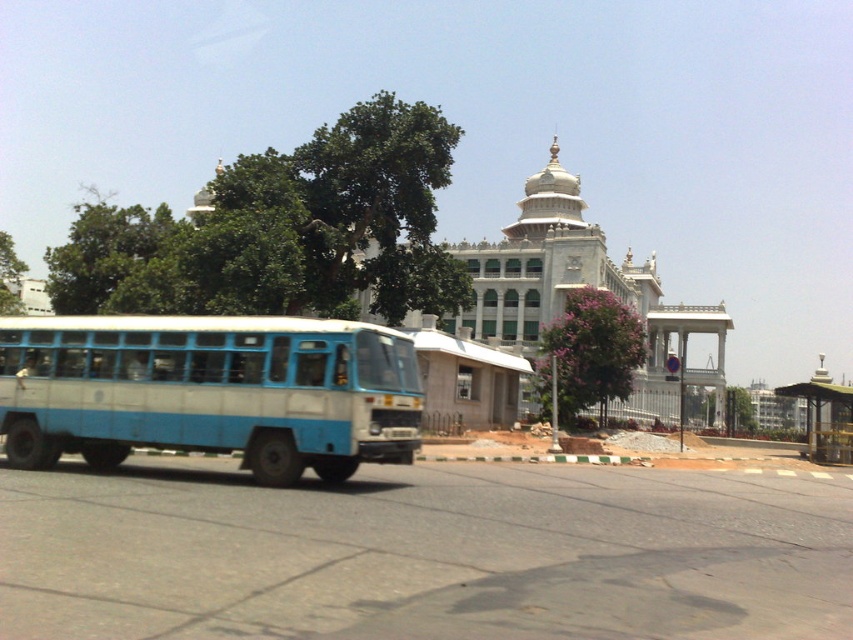
Question: Is white marble palace at center smaller than metallic green bus stop at lower right?

Choices:
 (A) yes
 (B) no

Answer: (B)

Question: Where is white marble palace at center located in relation to metallic green bus stop at lower right in the image?

Choices:
 (A) above
 (B) below

Answer: (A)

Question: Which point is farther to the camera?

Choices:
 (A) (625, 294)
 (B) (833, 394)

Answer: (A)

Question: Which point appears closest to the camera in this image?

Choices:
 (A) (463, 385)
 (B) (90, 378)
 (C) (843, 451)

Answer: (B)

Question: Can you confirm if blue matte bus at left is positioned to the right of metallic green bus stop at lower right?

Choices:
 (A) yes
 (B) no

Answer: (B)

Question: Which object is positioned closest to the white marble palace at center?

Choices:
 (A) blue matte bus at left
 (B) metallic green bus stop at lower right

Answer: (B)